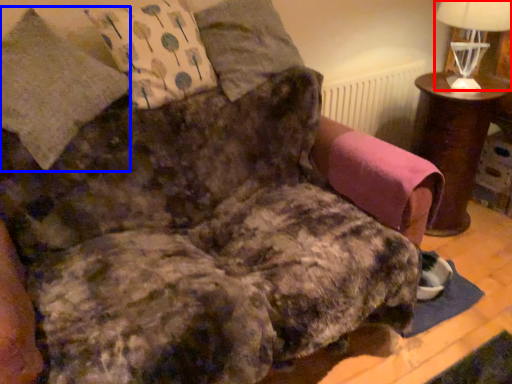
Question: Which object appears farthest to the camera in this image, table lamp (highlighted by a red box) or pillow (highlighted by a blue box)?

Choices:
 (A) table lamp
 (B) pillow

Answer: (A)